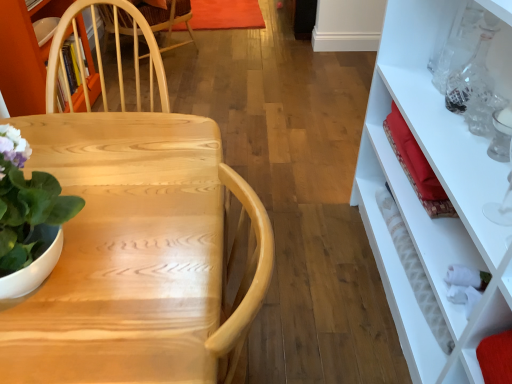
Question: Can you confirm if white textured bottle at right, the second bottle positioned from the top, is shorter than natural wood desk at center?

Choices:
 (A) no
 (B) yes

Answer: (B)

Question: Can you confirm if white textured bottle at right, which appears as the first bottle when ordered from the bottom, is taller than natural wood desk at center?

Choices:
 (A) no
 (B) yes

Answer: (A)

Question: Can you confirm if white textured bottle at right, the 1th bottle in the left-to-right sequence, is thinner than natural wood desk at center?

Choices:
 (A) no
 (B) yes

Answer: (B)

Question: Does white textured bottle at right, arranged as the 2th bottle when viewed from the right, have a larger size compared to natural wood desk at center?

Choices:
 (A) no
 (B) yes

Answer: (A)

Question: From a real-world perspective, does white textured bottle at right, the 1th bottle in the left-to-right sequence, sit lower than natural wood desk at center?

Choices:
 (A) no
 (B) yes

Answer: (B)

Question: Is white textured bottle at right, which appears as the first bottle when ordered from the bottom, wider than natural wood desk at center?

Choices:
 (A) no
 (B) yes

Answer: (A)

Question: Is white textured bottle at right, the second bottle positioned from the top, positioned behind transparent glass bottle at upper right, which ranks as the 2th bottle in bottom-to-top order?

Choices:
 (A) yes
 (B) no

Answer: (A)

Question: Are white textured bottle at right, the second bottle positioned from the top, and transparent glass bottle at upper right, the 1th bottle positioned from the top, far apart?

Choices:
 (A) yes
 (B) no

Answer: (B)

Question: Is white textured bottle at right, the second bottle positioned from the top, looking in the opposite direction of transparent glass bottle at upper right, the 2th bottle in the left-to-right sequence?

Choices:
 (A) no
 (B) yes

Answer: (A)

Question: Considering the relative positions of white textured bottle at right, which appears as the first bottle when ordered from the bottom, and transparent glass bottle at upper right, which ranks as the 2th bottle in bottom-to-top order, in the image provided, is white textured bottle at right, which appears as the first bottle when ordered from the bottom, to the left of transparent glass bottle at upper right, which ranks as the 2th bottle in bottom-to-top order, from the viewer's perspective?

Choices:
 (A) no
 (B) yes

Answer: (B)

Question: From a real-world perspective, is white textured bottle at right, the 1th bottle in the left-to-right sequence, on top of transparent glass bottle at upper right, which ranks as the 2th bottle in bottom-to-top order?

Choices:
 (A) no
 (B) yes

Answer: (A)

Question: Considering the relative sizes of white textured bottle at right, the second bottle positioned from the top, and transparent glass bottle at upper right, the 2th bottle in the left-to-right sequence, in the image provided, is white textured bottle at right, the second bottle positioned from the top, shorter than transparent glass bottle at upper right, the 2th bottle in the left-to-right sequence,?

Choices:
 (A) yes
 (B) no

Answer: (A)

Question: Does green matte plant at left come behind white textured bottle at right, the 1th bottle in the left-to-right sequence?

Choices:
 (A) yes
 (B) no

Answer: (B)